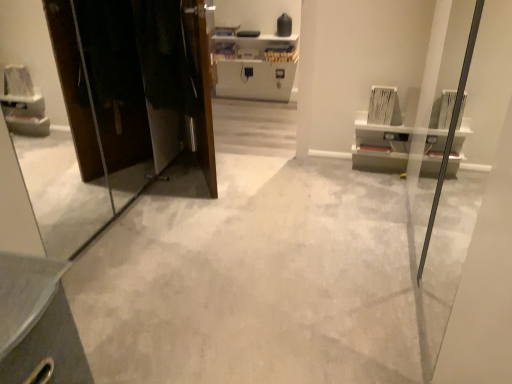
What do you see at coordinates (47, 137) in the screenshot? I see `transparent glass mirror at left` at bounding box center [47, 137].

Where is `transparent glass mirror at left`? transparent glass mirror at left is located at coordinates (47, 137).

I want to click on transparent glass mirror at left, so click(x=47, y=137).